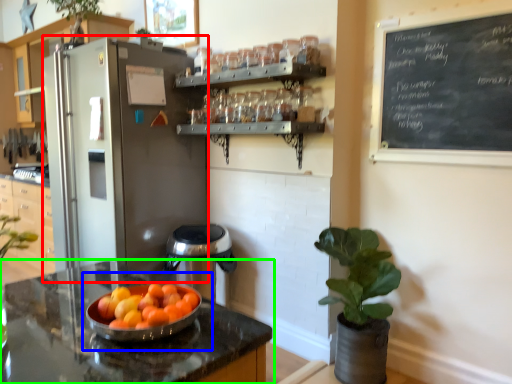
Question: Which object is the farthest from appliance (highlighted by a red box)? Choose among these: fruit dish (highlighted by a blue box) or countertop (highlighted by a green box).

Choices:
 (A) fruit dish
 (B) countertop

Answer: (A)